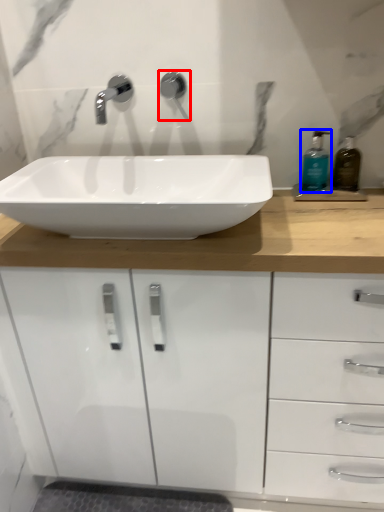
Question: Which of the following is the farthest to the observer, plumbing fixture (highlighted by a red box) or soap dispenser (highlighted by a blue box)?

Choices:
 (A) plumbing fixture
 (B) soap dispenser

Answer: (A)